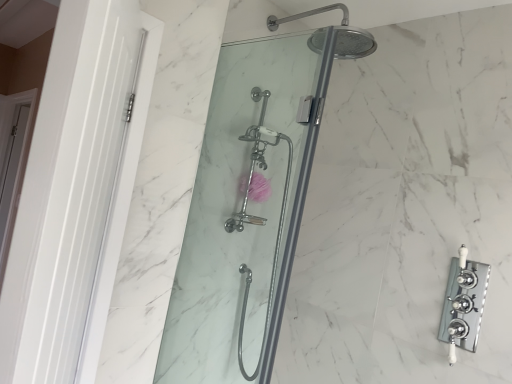
Question: Is clear glass shower door at center, the 2th shower door viewed from the front, closer to the viewer compared to chrome/polished metal faucet at right?

Choices:
 (A) no
 (B) yes

Answer: (A)

Question: Considering the relative sizes of clear glass shower door at center, the 2th shower door viewed from the front, and chrome/polished metal faucet at right in the image provided, is clear glass shower door at center, the 2th shower door viewed from the front, smaller than chrome/polished metal faucet at right?

Choices:
 (A) yes
 (B) no

Answer: (B)

Question: Can you confirm if clear glass shower door at center, which appears as the 1th shower door when viewed from the back, is bigger than chrome/polished metal faucet at right?

Choices:
 (A) no
 (B) yes

Answer: (B)

Question: From a real-world perspective, is clear glass shower door at center, which appears as the 1th shower door when viewed from the back, beneath chrome/polished metal faucet at right?

Choices:
 (A) yes
 (B) no

Answer: (A)

Question: Is clear glass shower door at center, which appears as the 1th shower door when viewed from the back, surrounding chrome/polished metal faucet at right?

Choices:
 (A) no
 (B) yes

Answer: (A)

Question: From the image's perspective, is chrome/polished metal faucet at right located above or below white glossy door at left, marked as the 2th screen door in a left-to-right arrangement?

Choices:
 (A) below
 (B) above

Answer: (A)

Question: Considering the relative positions of chrome/polished metal faucet at right and white glossy door at left, the 1th screen door when ordered from right to left, in the image provided, is chrome/polished metal faucet at right to the left or to the right of white glossy door at left, the 1th screen door when ordered from right to left,?

Choices:
 (A) right
 (B) left

Answer: (A)

Question: From a real-world perspective, is chrome/polished metal faucet at right above or below white glossy door at left, the 1th screen door when ordered from right to left?

Choices:
 (A) below
 (B) above

Answer: (A)

Question: In terms of width, does chrome/polished metal faucet at right look wider or thinner when compared to white glossy door at left, arranged as the 2th screen door when viewed from the back?

Choices:
 (A) wide
 (B) thin

Answer: (B)

Question: Is clear glass shower door at center, the 2th shower door viewed from the front, inside or outside of clear glass shower door at center, which is the second shower door in back-to-front order?

Choices:
 (A) inside
 (B) outside

Answer: (B)

Question: Considering their positions, is clear glass shower door at center, the 2th shower door viewed from the front, located in front of or behind clear glass shower door at center, placed as the first shower door when sorted from front to back?

Choices:
 (A) front
 (B) behind

Answer: (B)

Question: From the image's perspective, is clear glass shower door at center, which appears as the 1th shower door when viewed from the back, located above or below clear glass shower door at center, which is the second shower door in back-to-front order?

Choices:
 (A) above
 (B) below

Answer: (B)

Question: Considering the positions of clear glass shower door at center, the 2th shower door viewed from the front, and clear glass shower door at center, which is the second shower door in back-to-front order, in the image, is clear glass shower door at center, the 2th shower door viewed from the front, taller or shorter than clear glass shower door at center, which is the second shower door in back-to-front order,?

Choices:
 (A) tall
 (B) short

Answer: (B)

Question: Considering the positions of point (73, 344) and point (264, 104), is point (73, 344) closer or farther from the camera than point (264, 104)?

Choices:
 (A) farther
 (B) closer

Answer: (B)

Question: Choose the correct answer: Is white glossy door at left, which ranks as the 1th screen door in front-to-back order, inside clear glass shower door at center, which appears as the 1th shower door when viewed from the back, or outside it?

Choices:
 (A) inside
 (B) outside

Answer: (B)